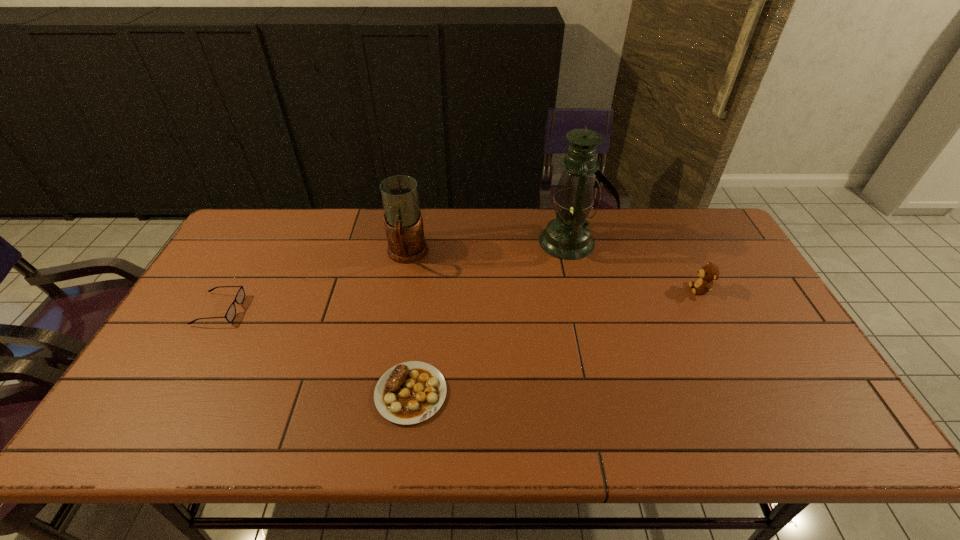
Where is `free point that satisfies the following two spatial constraints: 1. with the handle on the side of the fourth shortest object; 2. on the front-facing side of the leftmost object`? The height and width of the screenshot is (540, 960). free point that satisfies the following two spatial constraints: 1. with the handle on the side of the fourth shortest object; 2. on the front-facing side of the leftmost object is located at coordinates (397, 309).

This screenshot has height=540, width=960. Find the location of `free location that satisfies the following two spatial constraints: 1. on the back side of the nearest object; 2. on the front-facing side of the leftmost object`. free location that satisfies the following two spatial constraints: 1. on the back side of the nearest object; 2. on the front-facing side of the leftmost object is located at coordinates (421, 309).

The width and height of the screenshot is (960, 540). In order to click on free space in the image that satisfies the following two spatial constraints: 1. on the front side of the oil lamp; 2. on the front-facing side of the leftmost object in this screenshot , I will do `click(582, 309)`.